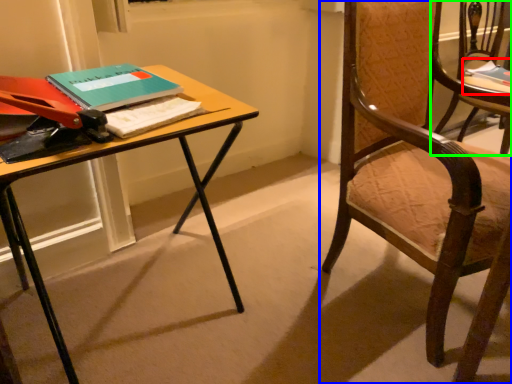
Question: Based on their relative distances, which object is nearer to book (highlighted by a red box)? Choose from chair (highlighted by a blue box) and chair (highlighted by a green box).

Choices:
 (A) chair
 (B) chair

Answer: (B)